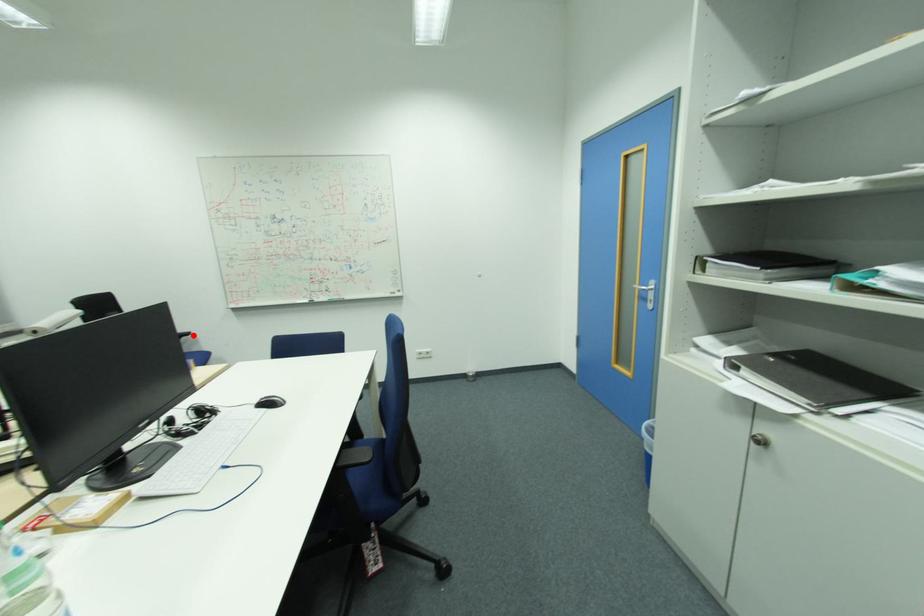
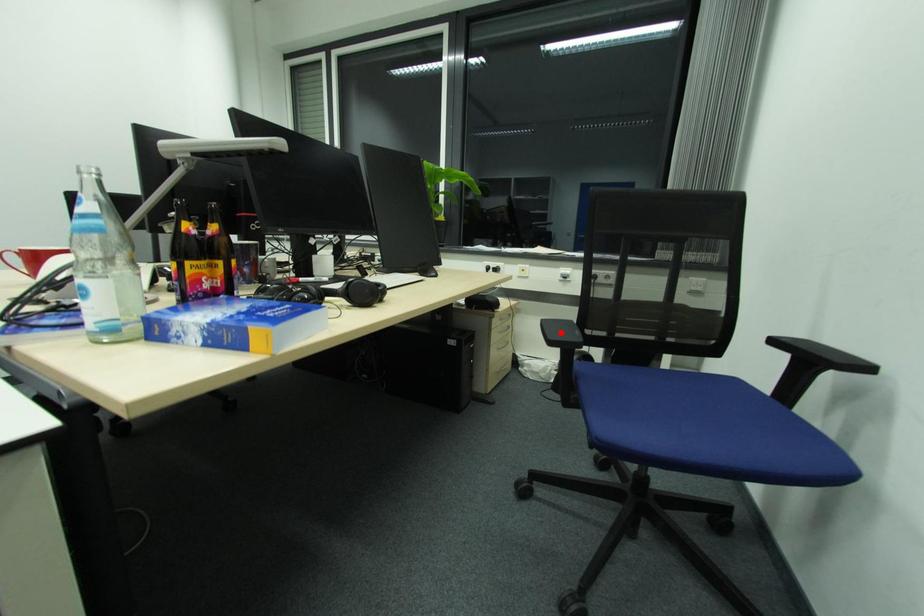
I am providing you with two images of the same scene from different viewpoints. A red point is marked on the first image and another point is marked on the second image. Do the highlighted points in image1 and image2 indicate the same real-world spot?

No